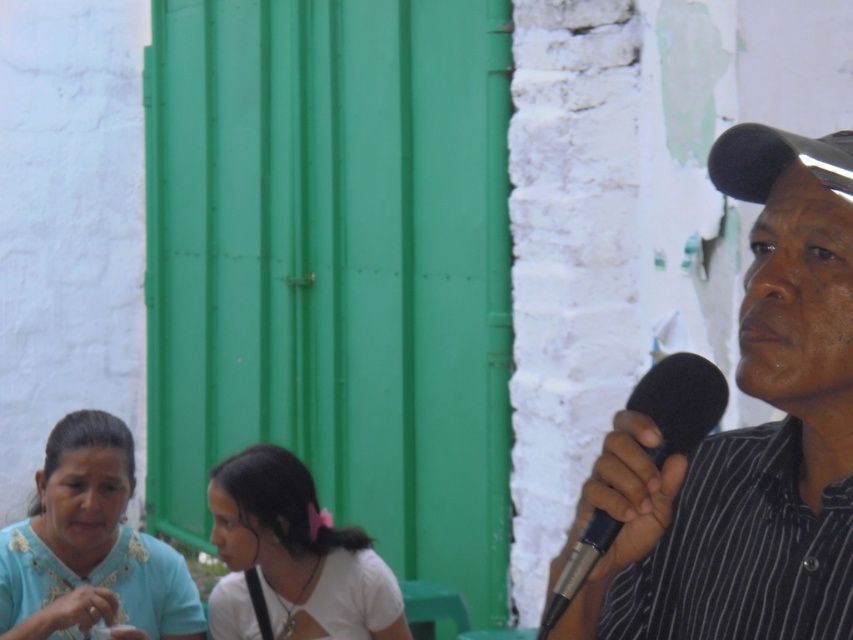
Consider the image. You are a photographer setting up for a group photo. You notice the teal fabric shirt at lower left and the white matte shirt at center. Which shirt should you adjust to ensure both are fully visible in the photo?

You should adjust the teal fabric shirt at lower left because it is in front of the white matte shirt at center, blocking part of it from view.

You are organizing a clothing display and need to arrange the black striped shirt at right and the white matte shirt at center based on their widths. Which shirt should be placed on the narrower side of the display?

The black striped shirt at right has a lesser width compared to the white matte shirt at center, so it should be placed on the narrower side of the display.

You are standing in the room and want to hand a note to the person closest to you. Which object should you approach first, the teal fabric shirt at lower left or the black foam microphone at right?

The teal fabric shirt at lower left is closer to you than the black foam microphone at right, so you should approach the teal fabric shirt at lower left first.